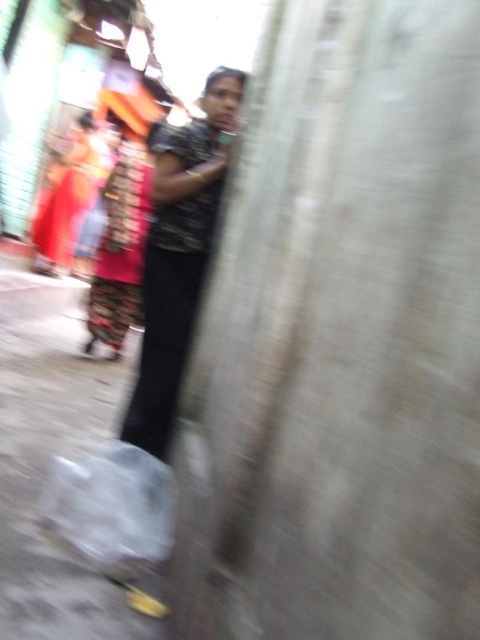
Is dark textured shirt at center below matte red saree at left?

Indeed, dark textured shirt at center is positioned under matte red saree at left.

Can you confirm if dark textured shirt at center is taller than matte red saree at left?

Incorrect, dark textured shirt at center's height is not larger of matte red saree at left's.

This screenshot has height=640, width=480. I want to click on dark textured shirt at center, so click(x=179, y=253).

Is dark textured shirt at center further to the viewer compared to shiny red fabric dress at center?

No, it is not.

Is dark textured shirt at center shorter than shiny red fabric dress at center?

Indeed, dark textured shirt at center has a lesser height compared to shiny red fabric dress at center.

This screenshot has height=640, width=480. In order to click on dark textured shirt at center in this screenshot , I will do `click(179, 253)`.

Is shiny red fabric dress at center taller than matte red saree at left?

No, shiny red fabric dress at center is not taller than matte red saree at left.

Is point (120, 170) positioned after point (70, 211)?

That is False.

This screenshot has height=640, width=480. What are the coordinates of `shiny red fabric dress at center` in the screenshot? It's located at 120,252.